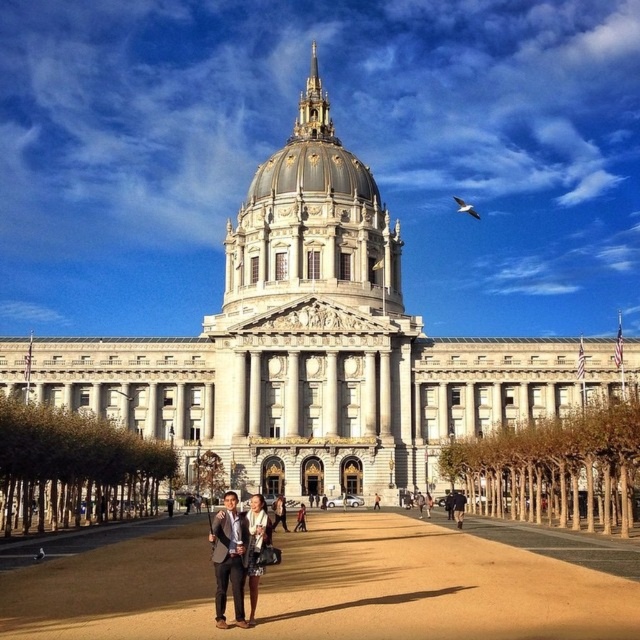
You are a photographer adjusting the camera settings to ensure both the matte black suit at center and the matte black dress at lower center are in focus. Which object should you focus on first to account for their height difference?

The matte black suit at center is taller than the matte black dress at lower center, so you should focus on the matte black suit at center first to ensure proper depth of field.